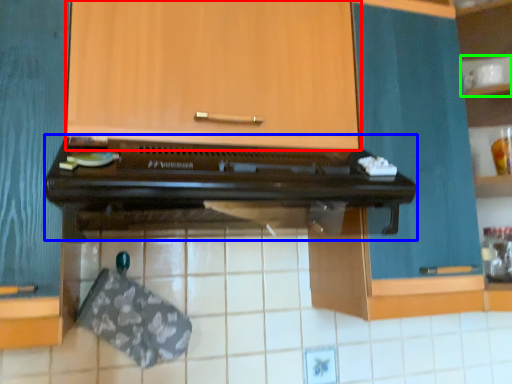
Question: Which object is the farthest from cabinetry (highlighted by a red box)? Choose among these: oven (highlighted by a blue box) or shelf (highlighted by a green box).

Choices:
 (A) oven
 (B) shelf

Answer: (B)